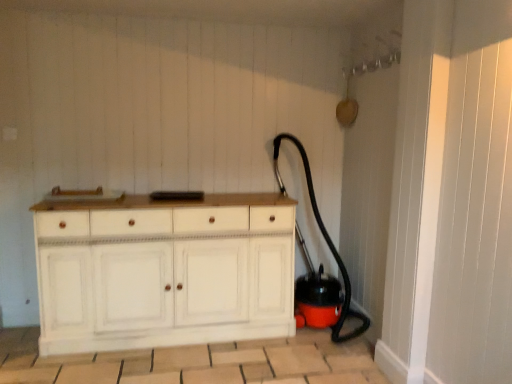
In order to face black rubber garden hose at lower right, should I rotate leftwards or rightwards?

Rotate your view right by about 8.305°.

Image resolution: width=512 pixels, height=384 pixels. Describe the element at coordinates (325, 240) in the screenshot. I see `black rubber garden hose at lower right` at that location.

Find the location of `black rubber garden hose at lower right`. black rubber garden hose at lower right is located at coordinates (325, 240).

Identify the location of white wood chest of drawers at center. This screenshot has height=384, width=512. (164, 271).

Measure the distance between white wood chest of drawers at center and camera.

white wood chest of drawers at center and camera are 7.92 feet apart from each other.

Describe the element at coordinates (164, 271) in the screenshot. I see `white wood chest of drawers at center` at that location.

Measure the distance between point [197,256] and camera.

They are 2.62 meters apart.

You are a GUI agent. You are given a task and a screenshot of the screen. Output one action in this format:
    pyautogui.click(x=<x>, y=<y>)
    Task: Click on the black rubber garden hose at lower right
    
    Given the screenshot: What is the action you would take?
    pyautogui.click(x=325, y=240)

Can you confirm if black rubber garden hose at lower right is positioned to the left of white wood chest of drawers at center?

No.

Considering the positions of objects black rubber garden hose at lower right and white wood chest of drawers at center in the image provided, who is in front, black rubber garden hose at lower right or white wood chest of drawers at center?

Positioned in front is white wood chest of drawers at center.

Which is further, (298, 147) or (226, 260)?

The point (298, 147) is more distant.

From the image's perspective, which is below, black rubber garden hose at lower right or white wood chest of drawers at center?

From the image's view, white wood chest of drawers at center is below.

From a real-world perspective, relative to white wood chest of drawers at center, is black rubber garden hose at lower right vertically above or below?

Clearly, from a real-world perspective, black rubber garden hose at lower right is above white wood chest of drawers at center.

Between black rubber garden hose at lower right and white wood chest of drawers at center, which one has smaller width?

With smaller width is white wood chest of drawers at center.

Is black rubber garden hose at lower right shorter than white wood chest of drawers at center?

No, black rubber garden hose at lower right is not shorter than white wood chest of drawers at center.

Who is bigger, black rubber garden hose at lower right or white wood chest of drawers at center?

white wood chest of drawers at center is bigger.

Is black rubber garden hose at lower right situated inside white wood chest of drawers at center or outside?

black rubber garden hose at lower right cannot be found inside white wood chest of drawers at center.

Is black rubber garden hose at lower right directly adjacent to white wood chest of drawers at center?

No, black rubber garden hose at lower right is not making contact with white wood chest of drawers at center.

Is black rubber garden hose at lower right positioned with its back to white wood chest of drawers at center?

No.

In order to click on the chest of drawers lying below the black rubber garden hose at lower right (from the image's perspective) in this screenshot , I will do `click(164, 271)`.

Which is more to the left, white wood chest of drawers at center or black rubber garden hose at lower right?

white wood chest of drawers at center.

Looking at this image, considering the relative positions of white wood chest of drawers at center and black rubber garden hose at lower right in the image provided, is white wood chest of drawers at center in front of black rubber garden hose at lower right?

Yes, it is.

Which is further, (131, 242) or (360, 330)?

Positioned behind is point (360, 330).

From the image's perspective, does white wood chest of drawers at center appear higher than black rubber garden hose at lower right?

No, from the image's perspective, white wood chest of drawers at center is not over black rubber garden hose at lower right.

From a real-world perspective, between white wood chest of drawers at center and black rubber garden hose at lower right, who is vertically higher?

black rubber garden hose at lower right, from a real-world perspective.

Between white wood chest of drawers at center and black rubber garden hose at lower right, which one has smaller width?

Thinner between the two is white wood chest of drawers at center.

Based on the photo, who is shorter, white wood chest of drawers at center or black rubber garden hose at lower right?

white wood chest of drawers at center.

Which of these two, white wood chest of drawers at center or black rubber garden hose at lower right, is bigger?

white wood chest of drawers at center is bigger.

Is white wood chest of drawers at center spatially inside black rubber garden hose at lower right, or outside of it?

white wood chest of drawers at center lies outside black rubber garden hose at lower right.

Are white wood chest of drawers at center and black rubber garden hose at lower right located far from each other?

No, there isn't a large distance between white wood chest of drawers at center and black rubber garden hose at lower right.

Is white wood chest of drawers at center turned away from black rubber garden hose at lower right?

That's not correct — white wood chest of drawers at center is not looking away from black rubber garden hose at lower right.

How many degrees apart are the facing directions of white wood chest of drawers at center and black rubber garden hose at lower right?

The angle between the facing direction of white wood chest of drawers at center and the facing direction of black rubber garden hose at lower right is 3.17 degrees.

In the scene shown: Measure the distance from white wood chest of drawers at center to black rubber garden hose at lower right.

95.86 centimeters.

Identify the location of the chest of drawers located underneath the black rubber garden hose at lower right (from a real-world perspective). (164, 271).

Locate an element on the screen. Image resolution: width=512 pixels, height=384 pixels. chest of drawers lying on the left of black rubber garden hose at lower right is located at coordinates (164, 271).

I want to click on the chest of drawers that is below the black rubber garden hose at lower right (from the image's perspective), so click(164, 271).